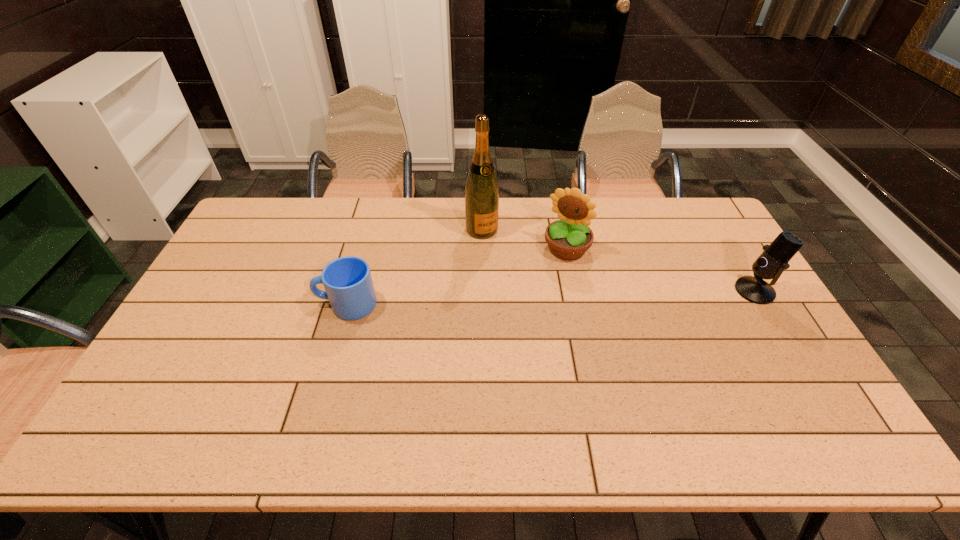
The height and width of the screenshot is (540, 960). In order to click on vacant space that is in between the rightmost object and the wine bottle in this screenshot , I will do 618,260.

At what (x,y) coordinates should I click in order to perform the action: click on vacant area that lies between the rightmost object and the tallest object. Please return your answer as a coordinate pair (x, y). Image resolution: width=960 pixels, height=540 pixels. Looking at the image, I should click on (618, 260).

Find the location of `blank region between the second object from left to right and the shortest object`. blank region between the second object from left to right and the shortest object is located at coordinates (414, 267).

Where is `free spot between the microphone and the tallest object`? This screenshot has height=540, width=960. free spot between the microphone and the tallest object is located at coordinates (618, 260).

You are a GUI agent. You are given a task and a screenshot of the screen. Output one action in this format:
    pyautogui.click(x=<x>, y=<y>)
    Task: Click on the free space between the microphone and the tallest object
    This screenshot has height=540, width=960.
    Given the screenshot: What is the action you would take?
    pyautogui.click(x=618, y=260)

The image size is (960, 540). I want to click on unoccupied area between the wine bottle and the sunflower, so click(524, 239).

You are a GUI agent. You are given a task and a screenshot of the screen. Output one action in this format:
    pyautogui.click(x=<x>, y=<y>)
    Task: Click on the object that is the second closest one to the rightmost object
    
    Given the screenshot: What is the action you would take?
    pyautogui.click(x=481, y=190)

Identify which object is located as the nearest to the leftmost object. Please provide its 2D coordinates. Your answer should be formatted as a tuple, i.e. [(x, y)], where the tuple contains the x and y coordinates of a point satisfying the conditions above.

[(481, 190)]

Locate an element on the screen. free space that satisfies the following two spatial constraints: 1. on the front side of the second object from right to left; 2. on the stand of the microphone is located at coordinates (576, 291).